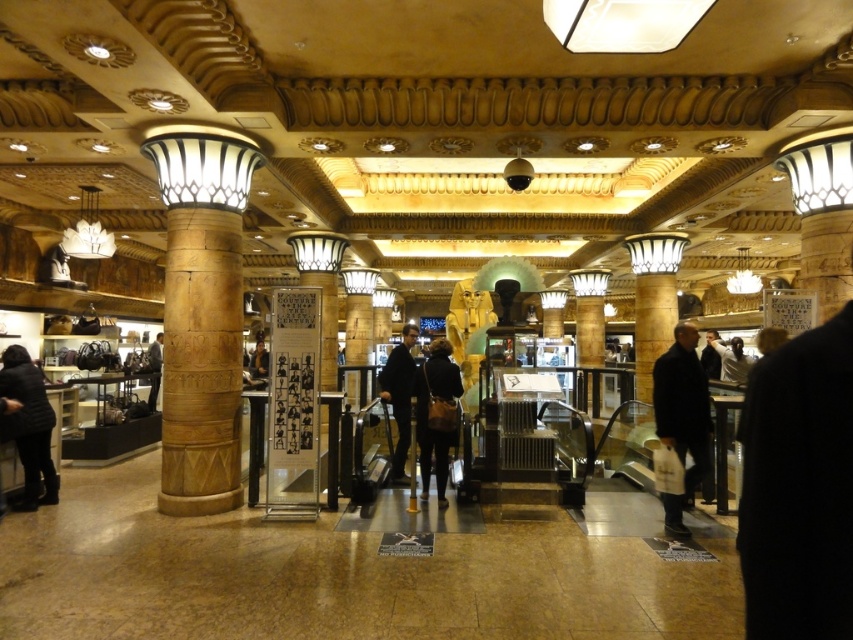
You are a customer in the mall and want to hang your dark gray fabric coat at lower left on a hook near the wooden column at left. Can you walk directly from your coat to the column without any obstacles?

The wooden column at left is to the right of dark gray fabric coat at lower left, so there is a direct path between them. You can walk directly from the dark gray fabric coat at lower left to the wooden column at left without any obstacles.

You are a customer in the mall and want to choose between the dark gray fabric coat at lower left and the dark blue fabric coat at center. Which coat is taller?

The dark gray fabric coat at lower left is much taller than the dark blue fabric coat at center.

You are a customer in the mall and want to place a white matte shirt at upper right on a hanger near the polished stone column at center. The hanger requires 1 foot of space. Is there enough space between them?

The distance between the polished stone column at center and the white matte shirt at upper right is 9.31 feet, which is more than enough space for the hanger requiring 1 foot. Yes, there is sufficient space.